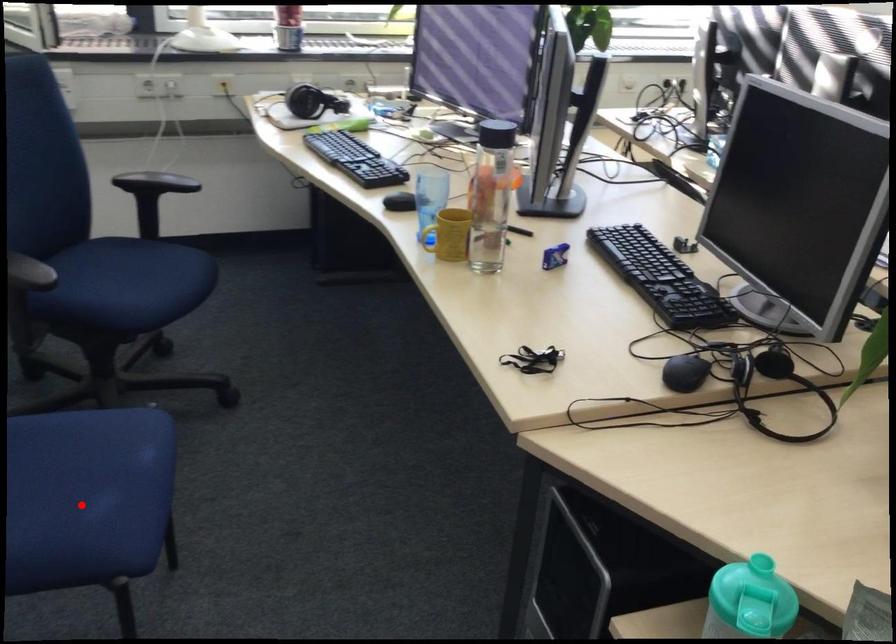
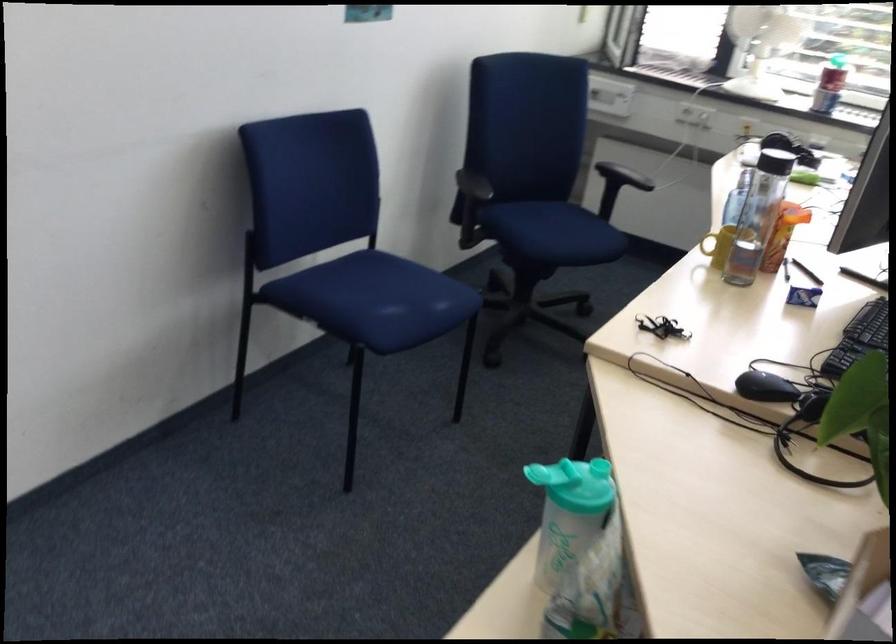
Question: I am providing you with two images of the same scene from different viewpoints. Image1 has a red point marked. In image2, the corresponding 3D location appears at what relative position? Reply with the corresponding letter.

Choices:
 (A) Closer
 (B) Farther

Answer: (B)